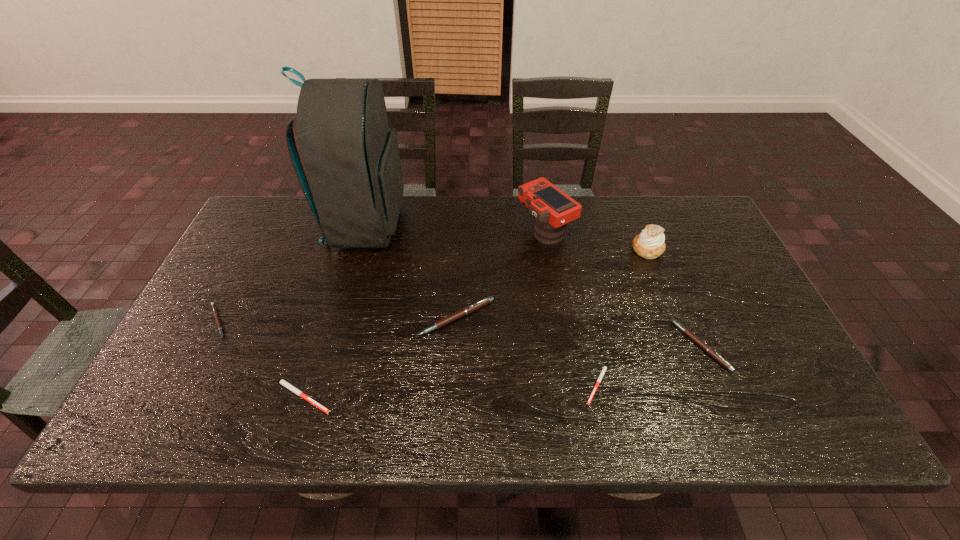
At what (x,y) coordinates should I click in order to perform the action: click on vacant area at the left edge. Please return your answer as a coordinate pair (x, y). This screenshot has height=540, width=960. Looking at the image, I should click on coord(237,288).

Locate an element on the screen. vacant space at the right edge of the desktop is located at coordinates (733, 367).

Locate an element on the screen. Image resolution: width=960 pixels, height=540 pixels. vacant space at the far left corner is located at coordinates (282, 235).

Locate an element on the screen. The height and width of the screenshot is (540, 960). free spot between the smaller white pen and the leftmost object is located at coordinates (408, 353).

This screenshot has height=540, width=960. Find the location of `empty space between the leftmost pink pen and the second tallest object`. empty space between the leftmost pink pen and the second tallest object is located at coordinates (381, 276).

Where is `vacant area between the pastry and the biggest pink pen`? vacant area between the pastry and the biggest pink pen is located at coordinates (552, 284).

Where is `free space between the second tallest object and the gray backpack`? free space between the second tallest object and the gray backpack is located at coordinates (455, 228).

Where is `free spot between the left white pen and the gray backpack`? Image resolution: width=960 pixels, height=540 pixels. free spot between the left white pen and the gray backpack is located at coordinates (334, 310).

The image size is (960, 540). What are the coordinates of `free space between the third tallest object and the bigger white pen` in the screenshot? It's located at (475, 323).

Where is `vacant space that is in between the seventh shortest object and the second tallest pen`? vacant space that is in between the seventh shortest object and the second tallest pen is located at coordinates (623, 288).